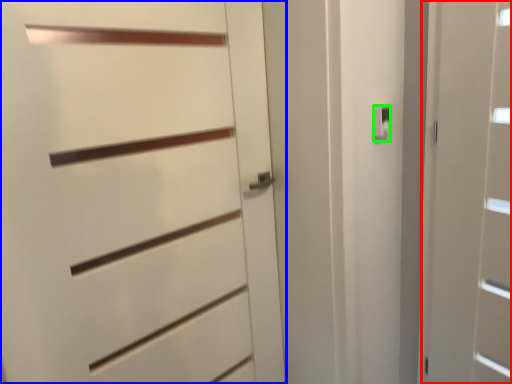
Question: Estimate the real-world distances between objects in this image. Which object is closer to door (highlighted by a red box), door (highlighted by a blue box) or latch (highlighted by a green box)?

Choices:
 (A) door
 (B) latch

Answer: (B)